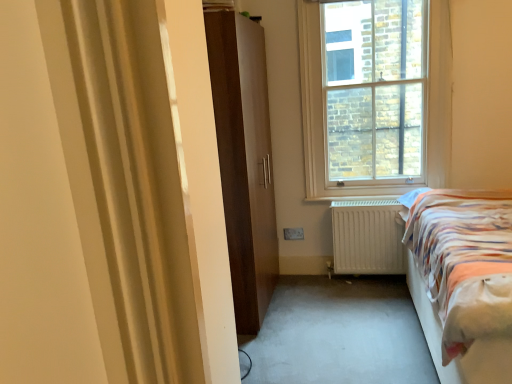
Question: Does white matte radiator at lower center have a larger size compared to matte brown wardrobe at center?

Choices:
 (A) yes
 (B) no

Answer: (B)

Question: Is white matte radiator at lower center not near matte brown wardrobe at center?

Choices:
 (A) yes
 (B) no

Answer: (B)

Question: From a real-world perspective, does white matte radiator at lower center sit lower than matte brown wardrobe at center?

Choices:
 (A) yes
 (B) no

Answer: (A)

Question: Can you confirm if white matte radiator at lower center is positioned to the left of matte brown wardrobe at center?

Choices:
 (A) yes
 (B) no

Answer: (B)

Question: Is matte brown wardrobe at center surrounded by white matte radiator at lower center?

Choices:
 (A) no
 (B) yes

Answer: (A)

Question: Considering the relative positions of striped fabric bed at right and white matte radiator at lower center in the image provided, is striped fabric bed at right to the left or to the right of white matte radiator at lower center?

Choices:
 (A) right
 (B) left

Answer: (A)

Question: From their relative heights in the image, would you say striped fabric bed at right is taller or shorter than white matte radiator at lower center?

Choices:
 (A) tall
 (B) short

Answer: (A)

Question: Considering the positions of striped fabric bed at right and white matte radiator at lower center in the image, is striped fabric bed at right wider or thinner than white matte radiator at lower center?

Choices:
 (A) wide
 (B) thin

Answer: (A)

Question: Considering the positions of striped fabric bed at right and white matte radiator at lower center in the image, is striped fabric bed at right bigger or smaller than white matte radiator at lower center?

Choices:
 (A) small
 (B) big

Answer: (B)

Question: Which is correct: striped fabric bed at right is inside matte brown wardrobe at center, or outside of it?

Choices:
 (A) inside
 (B) outside

Answer: (B)

Question: Is point (506, 294) closer or farther from the camera than point (224, 145)?

Choices:
 (A) closer
 (B) farther

Answer: (A)

Question: In terms of width, does striped fabric bed at right look wider or thinner when compared to matte brown wardrobe at center?

Choices:
 (A) wide
 (B) thin

Answer: (A)

Question: From a real-world perspective, is striped fabric bed at right positioned above or below matte brown wardrobe at center?

Choices:
 (A) above
 (B) below

Answer: (B)

Question: Is clear glass window at upper center bigger or smaller than white matte radiator at lower center?

Choices:
 (A) small
 (B) big

Answer: (B)

Question: Is clear glass window at upper center situated inside white matte radiator at lower center or outside?

Choices:
 (A) outside
 (B) inside

Answer: (A)